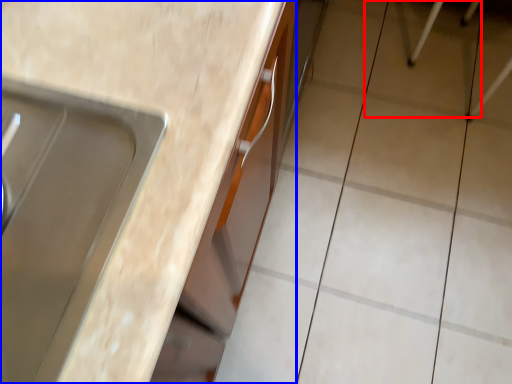
Question: Which of the following is the farthest to the observer, ceramic tile (highlighted by a red box) or countertop (highlighted by a blue box)?

Choices:
 (A) ceramic tile
 (B) countertop

Answer: (A)